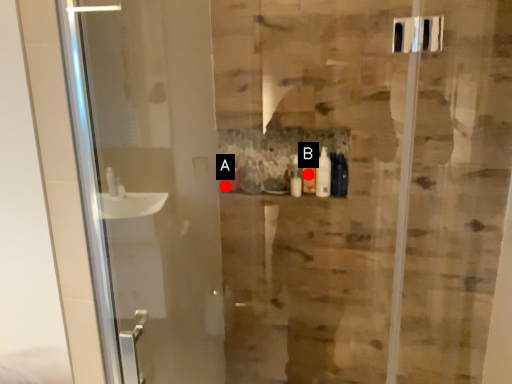
Question: Two points are circled on the image, labeled by A and B beside each circle. Which of the following is the farthest from the observer?

Choices:
 (A) A is further
 (B) B is further

Answer: (A)